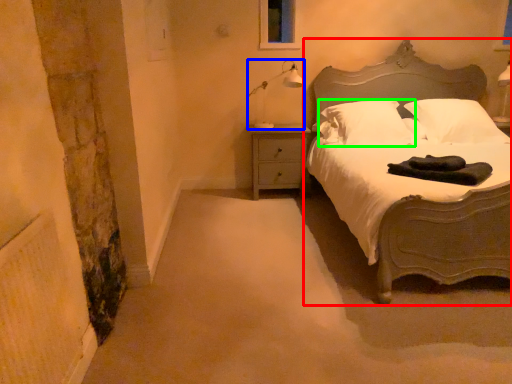
Question: Which object is the closest to the bed (highlighted by a red box)? Choose among these: lamp (highlighted by a blue box) or pillow (highlighted by a green box).

Choices:
 (A) lamp
 (B) pillow

Answer: (B)